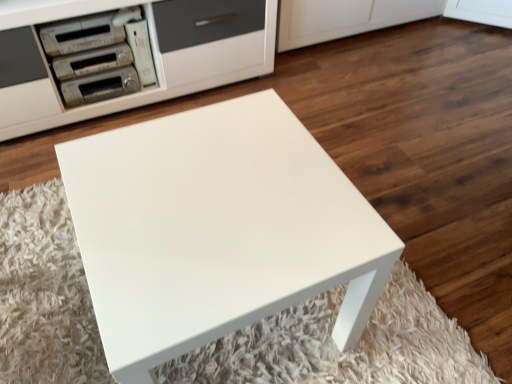
At what (x,y) coordinates should I click in order to perform the action: click on white glossy table at center. Please return your answer as a coordinate pair (x, y). Looking at the image, I should click on (217, 229).

What is the approximate height of white plastic game console at upper left, which is the 2th appliance from back to front?

The height of white plastic game console at upper left, which is the 2th appliance from back to front, is 30.30 centimeters.

Describe the element at coordinates (92, 61) in the screenshot. I see `matte silver stereo at upper left, acting as the third appliance starting from the back` at that location.

I want to click on metallic silver stereo at upper left, the fourth appliance viewed from the back, so click(81, 34).

The width and height of the screenshot is (512, 384). What are the coordinates of `white glossy table at center` in the screenshot? It's located at (217, 229).

From the picture: How many degrees apart are the facing directions of white plastic game console at upper left, the third appliance positioned from the front, and matte silver stereo at upper left, marked as the 2th appliance in a front-to-back arrangement?

The angular difference between white plastic game console at upper left, the third appliance positioned from the front, and matte silver stereo at upper left, marked as the 2th appliance in a front-to-back arrangement, is 7.42e-05 degrees.

Is matte silver stereo at upper left, marked as the 2th appliance in a front-to-back arrangement, inside white plastic game console at upper left, which is the 2th appliance from back to front?

No, white plastic game console at upper left, which is the 2th appliance from back to front, does not contain matte silver stereo at upper left, marked as the 2th appliance in a front-to-back arrangement.

From the image's perspective, is white plastic game console at upper left, the third appliance positioned from the front, located above matte silver stereo at upper left, marked as the 2th appliance in a front-to-back arrangement?

Yes, from the image's perspective, white plastic game console at upper left, the third appliance positioned from the front, is over matte silver stereo at upper left, marked as the 2th appliance in a front-to-back arrangement.

Considering the positions of objects white plastic game console at upper left, which is the 2th appliance from back to front, and matte silver stereo at upper left, marked as the 2th appliance in a front-to-back arrangement, in the image provided, who is more to the right, white plastic game console at upper left, which is the 2th appliance from back to front, or matte silver stereo at upper left, marked as the 2th appliance in a front-to-back arrangement,?

white plastic game console at upper left, which is the 2th appliance from back to front, is more to the right.

From the image's perspective, is metallic silver stereo at upper left, which appears as the first appliance when viewed from the front, under white plastic game console at upper left, the third appliance positioned from the front?

Incorrect, from the image's perspective, metallic silver stereo at upper left, which appears as the first appliance when viewed from the front, is higher than white plastic game console at upper left, the third appliance positioned from the front.

Which is in front, point (70, 31) or point (149, 72)?

The point (70, 31) is closer to the camera.

From a real-world perspective, is metallic silver stereo at upper left, the fourth appliance viewed from the back, positioned above or below white plastic game console at upper left, which is the 2th appliance from back to front?

metallic silver stereo at upper left, the fourth appliance viewed from the back, is situated higher than white plastic game console at upper left, which is the 2th appliance from back to front, in the real world.

Can you confirm if metallic silver stereo at upper left, the fourth appliance viewed from the back, is thinner than white plastic game console at upper left, the third appliance positioned from the front?

Indeed, metallic silver stereo at upper left, the fourth appliance viewed from the back, has a lesser width compared to white plastic game console at upper left, the third appliance positioned from the front.

In the scene shown: Is metallic silver stereo at upper left, the fourth appliance viewed from the back, at the left side of matte silver stereo at upper left, marked as the 2th appliance in a front-to-back arrangement?

Correct, you'll find metallic silver stereo at upper left, the fourth appliance viewed from the back, to the left of matte silver stereo at upper left, marked as the 2th appliance in a front-to-back arrangement.

Does point (97, 17) come behind point (116, 46)?

No, (97, 17) is closer to viewer.

Is metallic silver stereo at upper left, which appears as the first appliance when viewed from the front, bigger or smaller than matte silver stereo at upper left, acting as the third appliance starting from the back?

metallic silver stereo at upper left, which appears as the first appliance when viewed from the front, is bigger than matte silver stereo at upper left, acting as the third appliance starting from the back.

Looking at this image, is metallic silver stereo at upper left, which appears as the first appliance when viewed from the front, oriented away from matte silver stereo at upper left, acting as the third appliance starting from the back?

No.

Considering the relative sizes of white plastic game console at upper left, which is the 2th appliance from back to front, and metallic silver stereo at upper left, which appears as the first appliance when viewed from the front, in the image provided, is white plastic game console at upper left, which is the 2th appliance from back to front, taller than metallic silver stereo at upper left, which appears as the first appliance when viewed from the front,?

Correct, white plastic game console at upper left, which is the 2th appliance from back to front, is much taller as metallic silver stereo at upper left, which appears as the first appliance when viewed from the front.

Which object is further away from the camera taking this photo, white plastic game console at upper left, which is the 2th appliance from back to front, or metallic silver stereo at upper left, which appears as the first appliance when viewed from the front?

white plastic game console at upper left, which is the 2th appliance from back to front, is behind.

Can you confirm if white plastic game console at upper left, which is the 2th appliance from back to front, is positioned to the left of metallic silver stereo at upper left, which appears as the first appliance when viewed from the front?

No, white plastic game console at upper left, which is the 2th appliance from back to front, is not to the left of metallic silver stereo at upper left, which appears as the first appliance when viewed from the front.

Is white plastic game console at upper left, which is the 2th appliance from back to front, spatially inside metallic silver stereo at upper left, the fourth appliance viewed from the back, or outside of it?

white plastic game console at upper left, which is the 2th appliance from back to front, is not enclosed by metallic silver stereo at upper left, the fourth appliance viewed from the back.

Is white glossy table at center closer to the viewer compared to matte silver stereo at upper left, marked as the 2th appliance in a front-to-back arrangement?

Yes, white glossy table at center is closer to the camera.

Could you tell me if white glossy table at center is turned towards matte silver stereo at upper left, acting as the third appliance starting from the back?

No, white glossy table at center is not oriented towards matte silver stereo at upper left, acting as the third appliance starting from the back.

Is white glossy table at center placed right next to matte silver stereo at upper left, marked as the 2th appliance in a front-to-back arrangement?

No, white glossy table at center is not next to matte silver stereo at upper left, marked as the 2th appliance in a front-to-back arrangement.

In the scene shown: Considering the positions of objects white glossy table at center and matte silver stereo at upper left, acting as the third appliance starting from the back, in the image provided, who is more to the right, white glossy table at center or matte silver stereo at upper left, acting as the third appliance starting from the back,?

Positioned to the right is white glossy table at center.

Is the position of matte silver stereo at upper left, acting as the third appliance starting from the back, more distant than that of white glossy table at center?

Yes, the depth of matte silver stereo at upper left, acting as the third appliance starting from the back, is greater than that of white glossy table at center.

In the image, is matte silver stereo at upper left, marked as the 2th appliance in a front-to-back arrangement, on the left side or the right side of white glossy table at center?

Clearly, matte silver stereo at upper left, marked as the 2th appliance in a front-to-back arrangement, is on the left of white glossy table at center in the image.

Considering the points (112, 46) and (289, 138), which point is behind, point (112, 46) or point (289, 138)?

Point (112, 46)

Choose the correct answer: Is white plastic game console at upper left, which is the 2th appliance from back to front, inside metallic silver appliance at upper left, which is the fourth appliance in front-to-back order, or outside it?

white plastic game console at upper left, which is the 2th appliance from back to front, is located beyond the bounds of metallic silver appliance at upper left, which is the fourth appliance in front-to-back order.

Is white plastic game console at upper left, which is the 2th appliance from back to front, taller than metallic silver appliance at upper left, which is the fourth appliance in front-to-back order?

Yes, white plastic game console at upper left, which is the 2th appliance from back to front, is taller than metallic silver appliance at upper left, which is the fourth appliance in front-to-back order.

Is white plastic game console at upper left, which is the 2th appliance from back to front, at the left side of metallic silver appliance at upper left, the 1th appliance positioned from the back?

Incorrect, white plastic game console at upper left, which is the 2th appliance from back to front, is not on the left side of metallic silver appliance at upper left, the 1th appliance positioned from the back.

Can you confirm if white plastic game console at upper left, the third appliance positioned from the front, is thinner than metallic silver appliance at upper left, the 1th appliance positioned from the back?

In fact, white plastic game console at upper left, the third appliance positioned from the front, might be wider than metallic silver appliance at upper left, the 1th appliance positioned from the back.

Locate an element on the screen. The height and width of the screenshot is (384, 512). appliance that is the 1st object located below the white plastic game console at upper left, which is the 2th appliance from back to front (from the image's perspective) is located at coordinates (92, 61).

I want to click on appliance lying above the white plastic game console at upper left, which is the 2th appliance from back to front (from the image's perspective), so click(x=81, y=34).

Consider the image. Considering their positions, is metallic silver stereo at upper left, the fourth appliance viewed from the back, positioned closer to matte silver stereo at upper left, acting as the third appliance starting from the back, than metallic silver appliance at upper left, the 1th appliance positioned from the back?

Based on the image, metallic silver appliance at upper left, the 1th appliance positioned from the back, appears to be nearer to matte silver stereo at upper left, acting as the third appliance starting from the back.

From the image, which object appears to be farther from metallic silver stereo at upper left, which appears as the first appliance when viewed from the front, white plastic game console at upper left, the third appliance positioned from the front, or white glossy table at center?

white glossy table at center.

Consider the image. Estimate the real-world distances between objects in this image. Which object is further from matte silver stereo at upper left, acting as the third appliance starting from the back, metallic silver appliance at upper left, the 1th appliance positioned from the back, or white glossy table at center?

Among the two, white glossy table at center is located further to matte silver stereo at upper left, acting as the third appliance starting from the back.

Looking at the image, which one is located closer to metallic silver appliance at upper left, the 1th appliance positioned from the back, white plastic game console at upper left, the third appliance positioned from the front, or white glossy table at center?

Based on the image, white plastic game console at upper left, the third appliance positioned from the front, appears to be nearer to metallic silver appliance at upper left, the 1th appliance positioned from the back.

From the picture: Which object lies nearer to the anchor point white plastic game console at upper left, which is the 2th appliance from back to front, white glossy table at center or metallic silver appliance at upper left, the 1th appliance positioned from the back?

The object closer to white plastic game console at upper left, which is the 2th appliance from back to front, is metallic silver appliance at upper left, the 1th appliance positioned from the back.

Estimate the real-world distances between objects in this image. Which object is closer to matte silver stereo at upper left, acting as the third appliance starting from the back, white plastic game console at upper left, the third appliance positioned from the front, or metallic silver appliance at upper left, which is the fourth appliance in front-to-back order?

metallic silver appliance at upper left, which is the fourth appliance in front-to-back order, is positioned closer to the anchor matte silver stereo at upper left, acting as the third appliance starting from the back.

Which object lies nearer to the anchor point metallic silver stereo at upper left, the fourth appliance viewed from the back, metallic silver appliance at upper left, the 1th appliance positioned from the back, or white glossy table at center?

The object closer to metallic silver stereo at upper left, the fourth appliance viewed from the back, is metallic silver appliance at upper left, the 1th appliance positioned from the back.

Looking at the image, which one is located further to white glossy table at center, metallic silver appliance at upper left, which is the fourth appliance in front-to-back order, or white plastic game console at upper left, which is the 2th appliance from back to front?

metallic silver appliance at upper left, which is the fourth appliance in front-to-back order.

The height and width of the screenshot is (384, 512). I want to click on appliance between white glossy table at center and matte silver stereo at upper left, acting as the third appliance starting from the back, in the front-back direction, so click(81, 34).

This screenshot has height=384, width=512. I want to click on appliance located between matte silver stereo at upper left, marked as the 2th appliance in a front-to-back arrangement, and white plastic game console at upper left, the third appliance positioned from the front, in the left-right direction, so click(x=100, y=86).